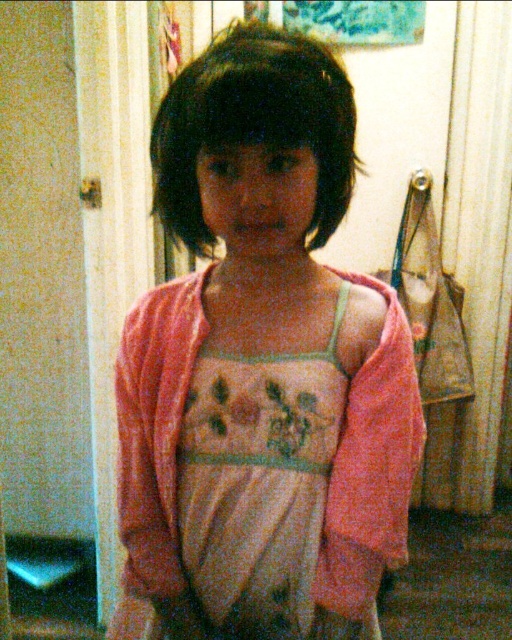
Is pink soft fabric dress at center to the left of dark matte hair at center from the viewer's perspective?

In fact, pink soft fabric dress at center is to the right of dark matte hair at center.

Identify the location of pink soft fabric dress at center. (262, 368).

This screenshot has width=512, height=640. Find the location of `pink soft fabric dress at center`. pink soft fabric dress at center is located at coordinates (262, 368).

What do you see at coordinates (262, 368) in the screenshot? I see `pink soft fabric dress at center` at bounding box center [262, 368].

Does point (180, 193) lie in front of point (236, 520)?

Yes, it is in front of point (236, 520).

Who is more distant from viewer, (148, 355) or (315, 413)?

The point (148, 355) is behind.

Where is `pink soft fabric dress at center`? This screenshot has width=512, height=640. pink soft fabric dress at center is located at coordinates (262, 368).

Is light pink fabric dress at center to the right of dark matte hair at center from the viewer's perspective?

Correct, you'll find light pink fabric dress at center to the right of dark matte hair at center.

Who is more distant from viewer, (252,552) or (305,51)?

The point (252,552) is behind.

This screenshot has height=640, width=512. Find the location of `light pink fabric dress at center`. light pink fabric dress at center is located at coordinates (259, 488).